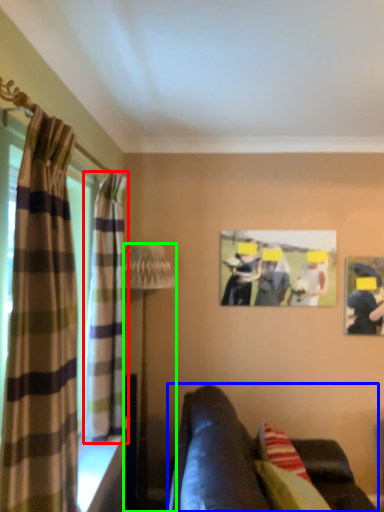
Question: Which object is positioned farthest from curtain (highlighted by a red box)? Select from studio couch (highlighted by a blue box) and lamp (highlighted by a green box).

Choices:
 (A) studio couch
 (B) lamp

Answer: (B)